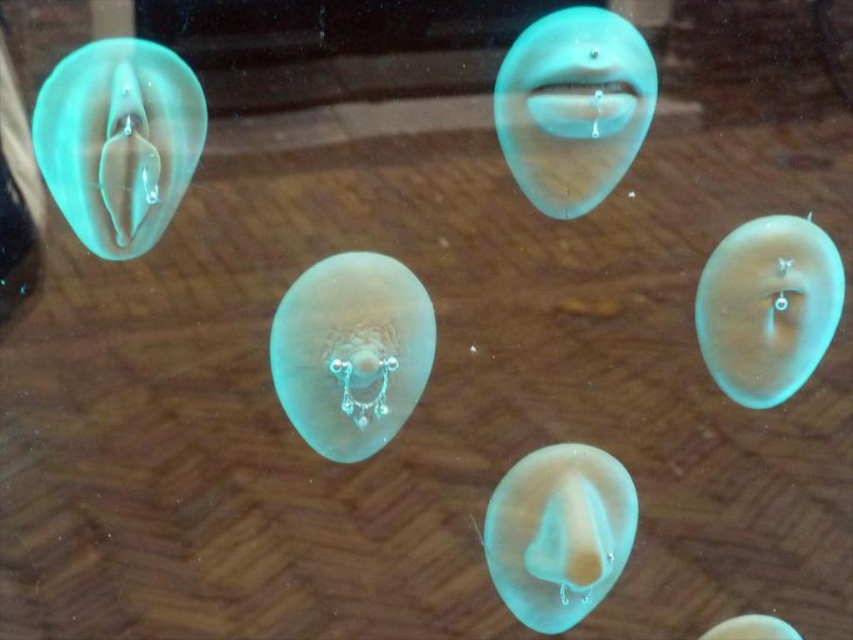
Is translucent rubber jellyfish at right behind translucent rubber jellyfish at lower right?

No, translucent rubber jellyfish at right is closer to the viewer.

Is point (838, 280) farther from camera compared to point (752, 614)?

No, it is in front of (752, 614).

Locate an element on the screen. translucent rubber jellyfish at right is located at coordinates (769, 307).

Does translucent plastic jellyfish at center have a smaller size compared to translucent plastic mouth at upper center?

No.

Does translucent plastic jellyfish at center appear on the left side of translucent plastic mouth at upper center?

Indeed, translucent plastic jellyfish at center is positioned on the left side of translucent plastic mouth at upper center.

Is point (395, 381) in front of point (619, 104)?

No.

Locate an element on the screen. translucent plastic jellyfish at center is located at coordinates (351, 353).

Does translucent rubber lips at upper center appear under translucent rubber jellyfish at lower right?

Actually, translucent rubber lips at upper center is above translucent rubber jellyfish at lower right.

Is point (622, 104) positioned before point (775, 625)?

No, it is not.

The width and height of the screenshot is (853, 640). I want to click on translucent rubber lips at upper center, so click(573, 108).